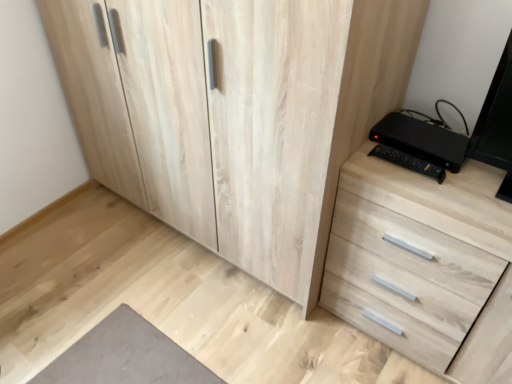
Find the location of `vacant space situated above black plastic at right (from a real-world perspective)`. vacant space situated above black plastic at right (from a real-world perspective) is located at coordinates (442, 140).